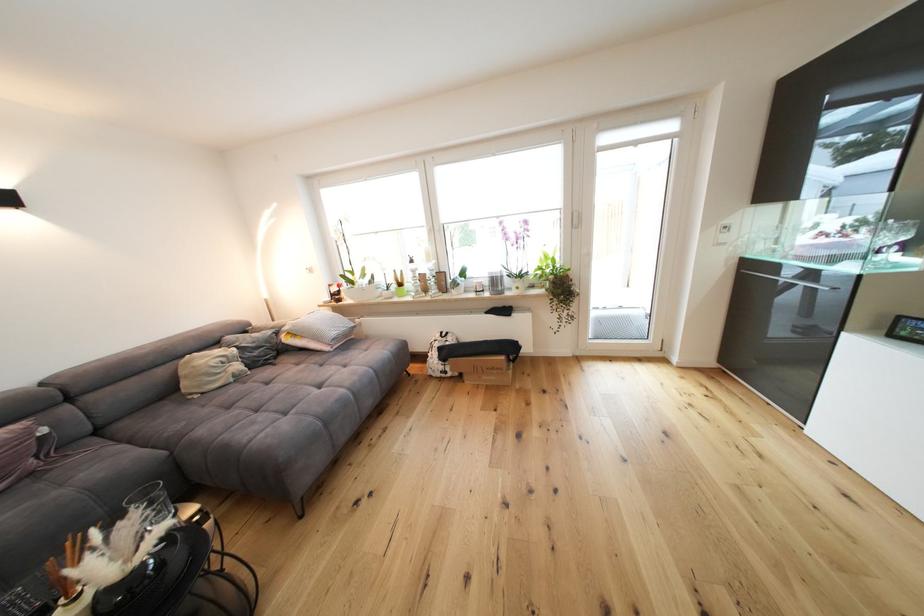
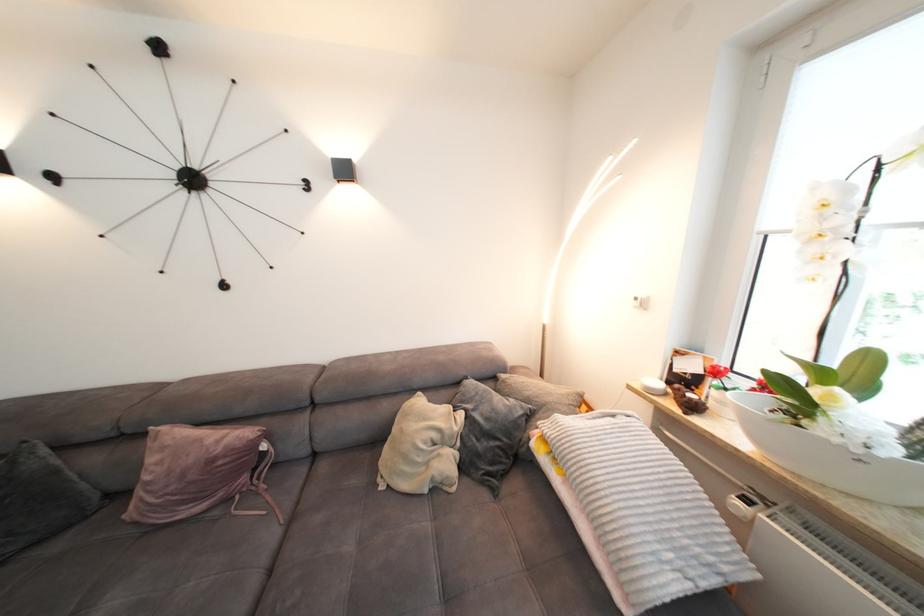
Locate, in the second image, the point that corresponds to the point at 235,362 in the first image.

(450, 440)